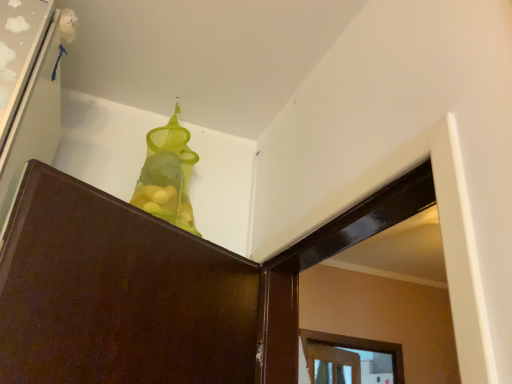
Locate an element on the screen. Image resolution: width=512 pixels, height=384 pixels. green mesh bag at upper center is located at coordinates tap(167, 175).

Describe the element at coordinates (167, 175) in the screenshot. I see `green mesh bag at upper center` at that location.

At what (x,y) coordinates should I click in order to perform the action: click on green mesh bag at upper center. Please return your answer as a coordinate pair (x, y). Looking at the image, I should click on (167, 175).